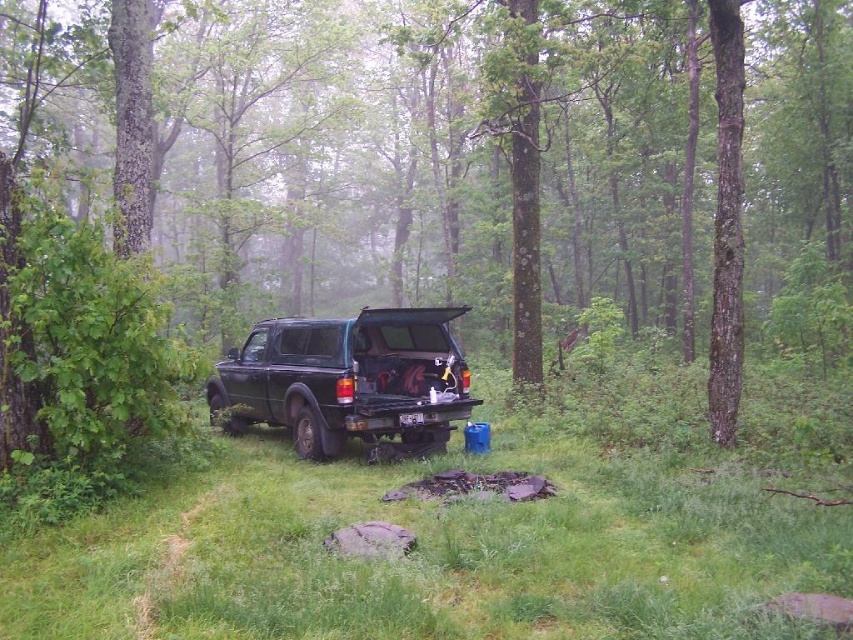
Question: Does green leafy tree at center appear over matte black truck at center?

Choices:
 (A) yes
 (B) no

Answer: (A)

Question: Does green leafy tree at center come in front of matte black truck at center?

Choices:
 (A) yes
 (B) no

Answer: (A)

Question: Does green leafy tree at center appear on the left side of matte black truck at center?

Choices:
 (A) no
 (B) yes

Answer: (B)

Question: Which point appears closest to the camera in this image?

Choices:
 (A) (392, 403)
 (B) (846, 186)

Answer: (A)

Question: Which of the following is the closest to the observer?

Choices:
 (A) (689, 260)
 (B) (402, 312)

Answer: (B)